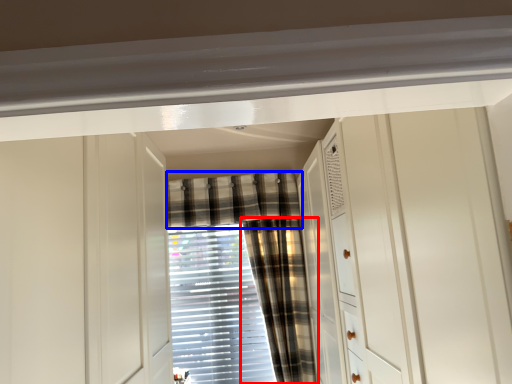
Question: Which of the following is the farthest to the observer, curtain (highlighted by a red box) or curtain (highlighted by a blue box)?

Choices:
 (A) curtain
 (B) curtain

Answer: (B)